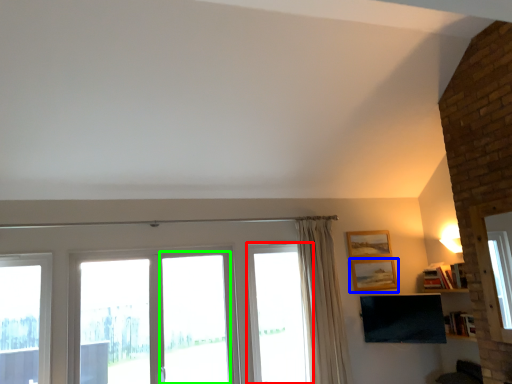
Question: Which is nearer to the window (highlighted by a red box)? picture frame (highlighted by a blue box) or screen door (highlighted by a green box).

Choices:
 (A) picture frame
 (B) screen door

Answer: (B)